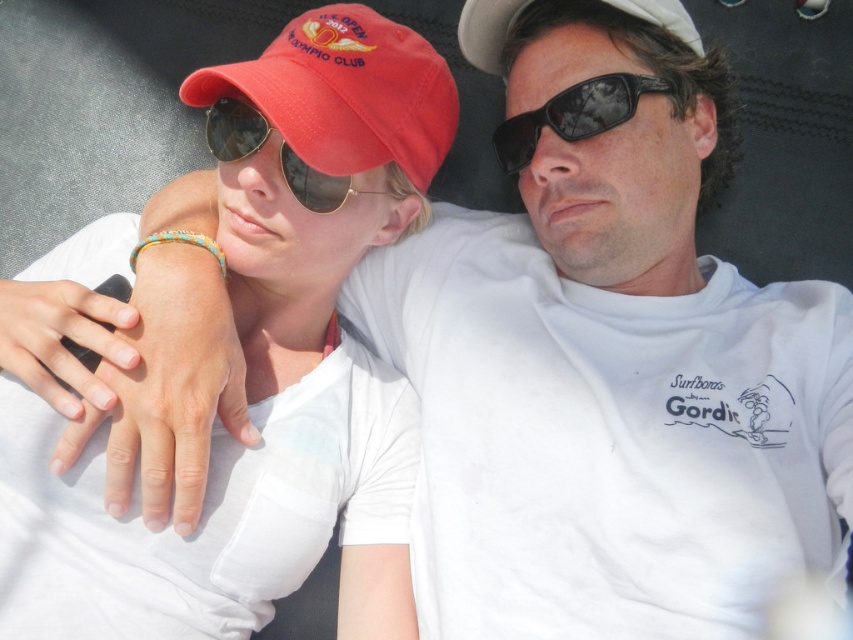
You are a photographer trying to capture a closeup of the sunglasses at center. You have a focus point at coordinate point (x=573, y=115). Will this point help you focus on the sunglasses?

Yes, the point (x=573, y=115) is on the black reflective sunglasses at center, so using this focus point will help you focus on the sunglasses.